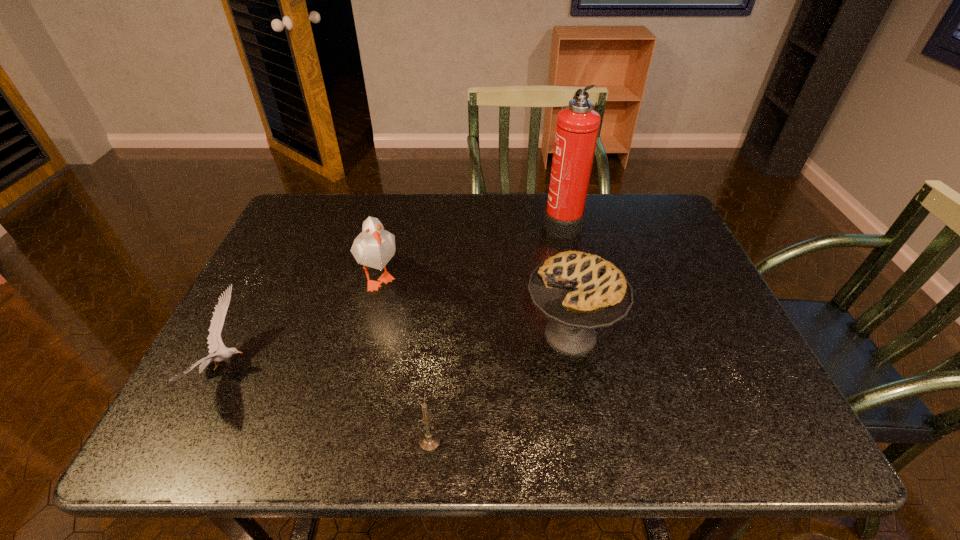
At what (x,y) coordinates should I click in order to perform the action: click on candle present at the near edge. Please return your answer as a coordinate pair (x, y). The image size is (960, 540). Looking at the image, I should click on (429, 441).

Find the location of a particular element. object that is positioned at the left edge is located at coordinates (214, 339).

Image resolution: width=960 pixels, height=540 pixels. Find the location of `object that is positioned at the near left corner`. object that is positioned at the near left corner is located at coordinates (214, 339).

Identify the location of vacant space at the far edge. (480, 200).

Image resolution: width=960 pixels, height=540 pixels. In order to click on vacant space at the near edge in this screenshot , I will do `click(434, 423)`.

Locate an element on the screen. The height and width of the screenshot is (540, 960). vacant point at the left edge is located at coordinates (258, 289).

At what (x,y) coordinates should I click in order to perform the action: click on free space at the right edge of the desktop. Please return your answer as a coordinate pair (x, y). The image size is (960, 540). Looking at the image, I should click on [x=712, y=287].

Where is `free space at the far left corner`? free space at the far left corner is located at coordinates (331, 222).

Locate an element on the screen. The width and height of the screenshot is (960, 540). vacant space at the near right corner of the desktop is located at coordinates (724, 451).

Image resolution: width=960 pixels, height=540 pixels. In order to click on vacant region between the nearest object and the fire extinguisher in this screenshot , I will do `click(495, 332)`.